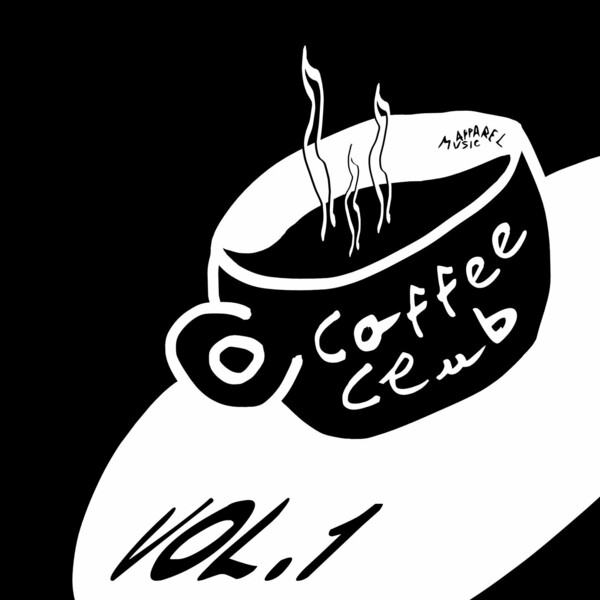
Locate an element on the screen. The height and width of the screenshot is (600, 600). black of mug is located at coordinates (329, 405).